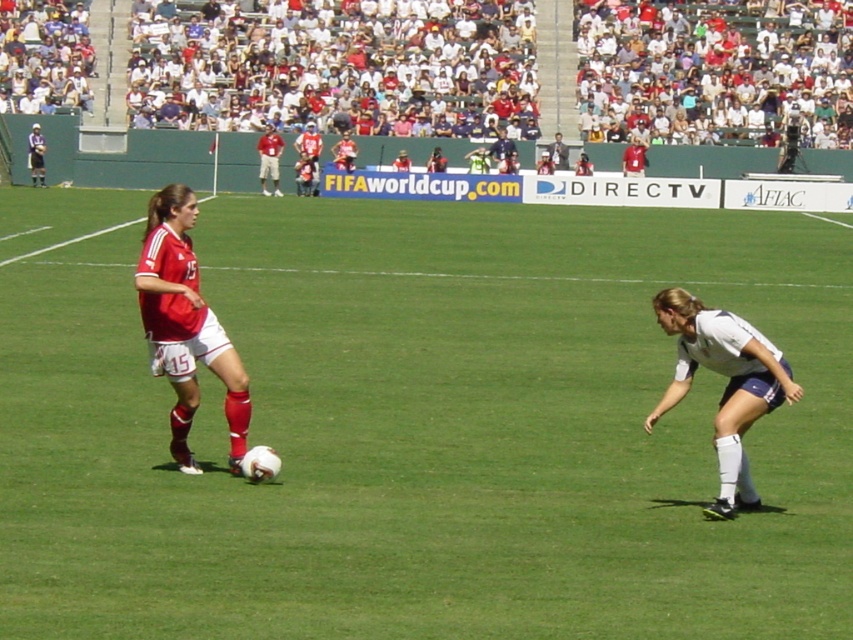
You are standing at the point marked as point (x=494, y=484) in the soccer field. A ball is coming towards you from the direction of the player in red jersey with number 15. Can you safely move 5 meters backward to avoid it?

The distance of point (x=494, y=484) from viewer is 10.83 meters, so moving 5 meters backward would place you at 5.83 meters from the original position, which is still within the field and safe distance to avoid the ball.

You are a photographer standing at the center of the soccer field. You want to take a photo that includes both the white cotton crowd at upper center and the matte red jersey at left. Given that your camera has a maximum focal length that allows capturing objects up to 30 meters apart in the same frame, will you be able to include both in a single shot?

The white cotton crowd at upper center and the matte red jersey at left are 35.57 meters apart from each other. Since the distance exceeds the camera maximum focal length of 30 meters, you cannot include both in a single shot.

You are a photographer at the soccer match and want to capture both the matte red jersey at left and the white matte shorts at lower right in the same frame. Based on their sizes in the image, which object would appear larger in your photo?

The matte red jersey at left appears larger in the photo because it is much taller than the white matte shorts at lower right.